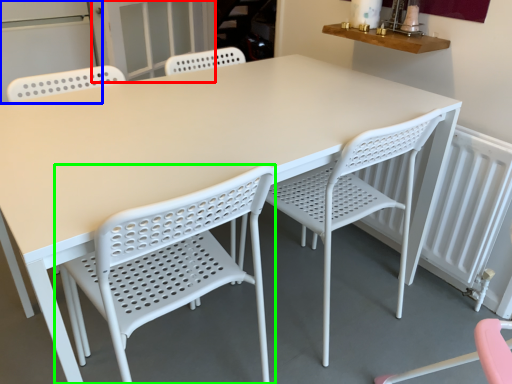
Question: Which is farther away from screen door (highlighted by a red box)? screen door (highlighted by a blue box) or chair (highlighted by a green box)?

Choices:
 (A) screen door
 (B) chair

Answer: (B)